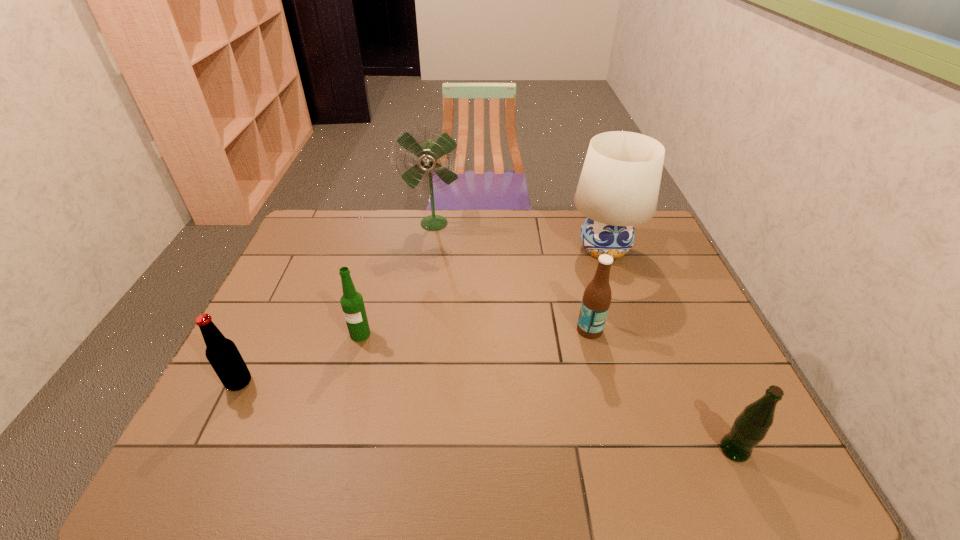
Where is `vacant space in between the second beer bottle from left to right and the fourth object from right to left`? vacant space in between the second beer bottle from left to right and the fourth object from right to left is located at coordinates pyautogui.click(x=397, y=279).

Where is `vacant area that lies between the leftmost beer bottle and the fourth object from right to left`? The image size is (960, 540). vacant area that lies between the leftmost beer bottle and the fourth object from right to left is located at coordinates (337, 302).

Select which object is the fourth closest to the third beer bottle from right to left. Please provide its 2D coordinates. Your answer should be formatted as a tuple, i.e. [(x, y)], where the tuple contains the x and y coordinates of a point satisfying the conditions above.

[(618, 188)]

Where is `the second closest object relative to the third beer bottle from right to left`? the second closest object relative to the third beer bottle from right to left is located at coordinates (428, 153).

Identify which beer bottle is the third closest to the third beer bottle from left to right. Please provide its 2D coordinates. Your answer should be formatted as a tuple, i.e. [(x, y)], where the tuple contains the x and y coordinates of a point satisfying the conditions above.

[(223, 355)]

Locate an element on the screen. Image resolution: width=960 pixels, height=540 pixels. beer bottle that is the closest to the rightmost beer bottle is located at coordinates click(x=596, y=300).

Where is `free space that satisfies the following two spatial constraints: 1. on the front-facing side of the nearest beer bottle; 2. on the left side of the fan`? The width and height of the screenshot is (960, 540). free space that satisfies the following two spatial constraints: 1. on the front-facing side of the nearest beer bottle; 2. on the left side of the fan is located at coordinates (402, 450).